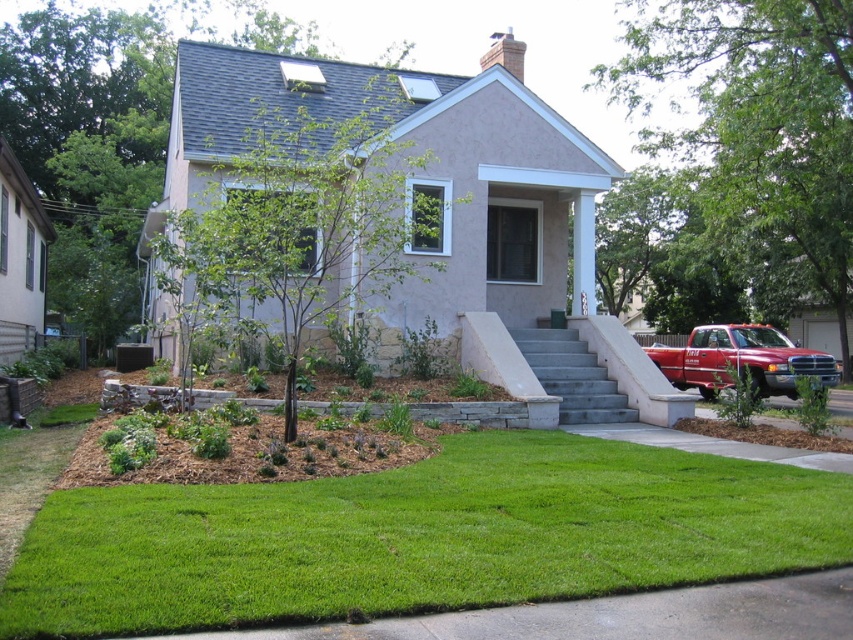
Is point (759, 332) positioned behind point (585, 384)?

Yes, point (759, 332) is behind point (585, 384).

Where is `matte red truck at right`? The image size is (853, 640). matte red truck at right is located at coordinates (741, 360).

Does green lawn at center have a lesser width compared to matte red truck at right?

Indeed, green lawn at center has a lesser width compared to matte red truck at right.

Between green lawn at center and matte red truck at right, which one has less height?

green lawn at center is shorter.

Is point (637, 458) more distant than point (759, 356)?

That is False.

Find the location of a particular element. This screenshot has height=640, width=853. green lawn at center is located at coordinates [416, 536].

Which is behind, point (247, 496) or point (577, 406)?

The point (577, 406) is more distant.

Does green lawn at center have a lesser width compared to gray concrete stairs at center?

Indeed, green lawn at center has a lesser width compared to gray concrete stairs at center.

You are a GUI agent. You are given a task and a screenshot of the screen. Output one action in this format:
    pyautogui.click(x=<x>, y=<y>)
    Task: Click on the green lawn at center
    This screenshot has height=640, width=853.
    Given the screenshot: What is the action you would take?
    pyautogui.click(x=416, y=536)